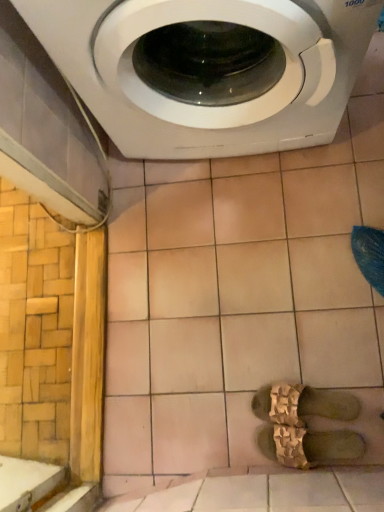
Where is `vacant space to the right of gold textured sandals at center, which appears as the 2th shoe when ordered from the bottom`? Image resolution: width=384 pixels, height=512 pixels. vacant space to the right of gold textured sandals at center, which appears as the 2th shoe when ordered from the bottom is located at coordinates (345, 346).